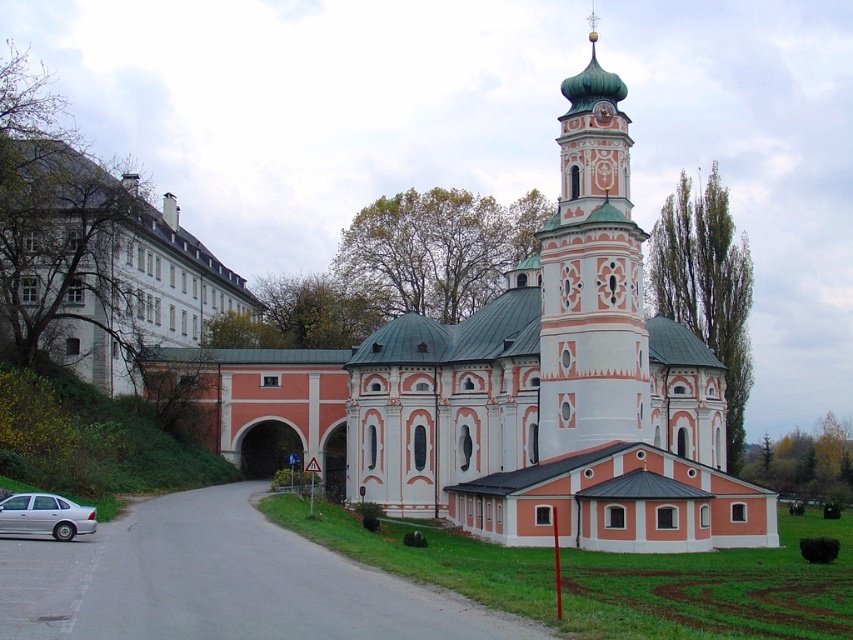
Question: Is white stucco church at center behind silver metallic car at lower left?

Choices:
 (A) yes
 (B) no

Answer: (A)

Question: Which of the following is the closest to the observer?

Choices:
 (A) light blue painted stone tower at center right
 (B) white stucco church at center

Answer: (B)

Question: Can you confirm if white stucco church at center is positioned to the left of silver metallic car at lower left?

Choices:
 (A) no
 (B) yes

Answer: (A)

Question: Considering the relative positions of white stucco church at center and silver metallic car at lower left in the image provided, where is white stucco church at center located with respect to silver metallic car at lower left?

Choices:
 (A) left
 (B) right

Answer: (B)

Question: Which point is farther to the camera?

Choices:
 (A) (550, 285)
 (B) (672, 426)

Answer: (B)

Question: Which of these objects is positioned farthest from the silver metallic car at lower left?

Choices:
 (A) light blue painted stone tower at center right
 (B) white stucco church at center

Answer: (A)